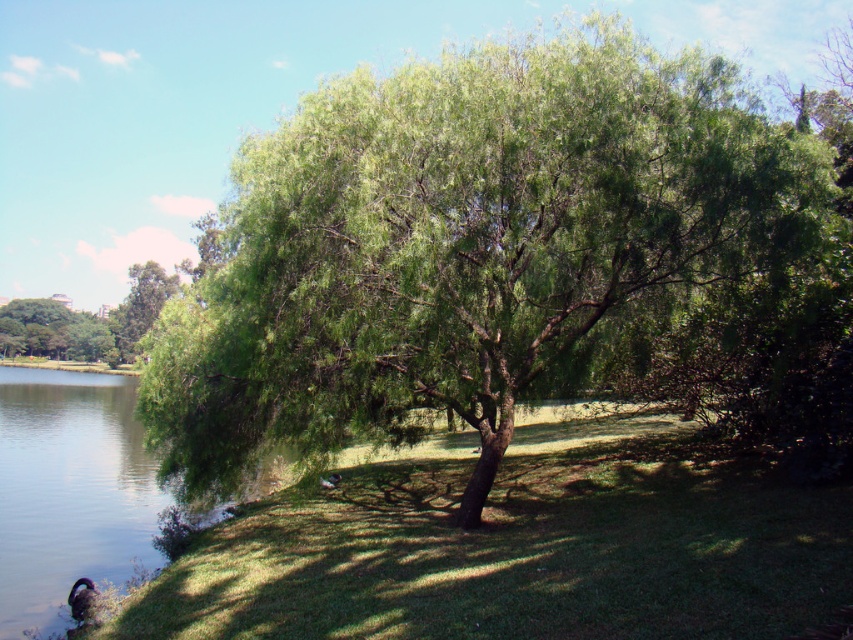
You are a gardener assessing the growth of plants in the scene. Which object, the green leafy tree at center or the green grass at center, is taller?

The green leafy tree at center is taller than the green grass at center.

You are standing in the park scene with the large tree. You see a point marked at coordinates [68,490]. What is located at that point?

The point at coordinates [68,490] marks clear water at lower left.

You are planning to set up a picnic blanket in the scene. The picnic blanket requires an area larger than the green grass at center. Can you use the clear water at lower left for this purpose?

The clear water at lower left is larger than the green grass at center, but since it is water, it is not suitable for placing a picnic blanket. You should look for a land area instead.